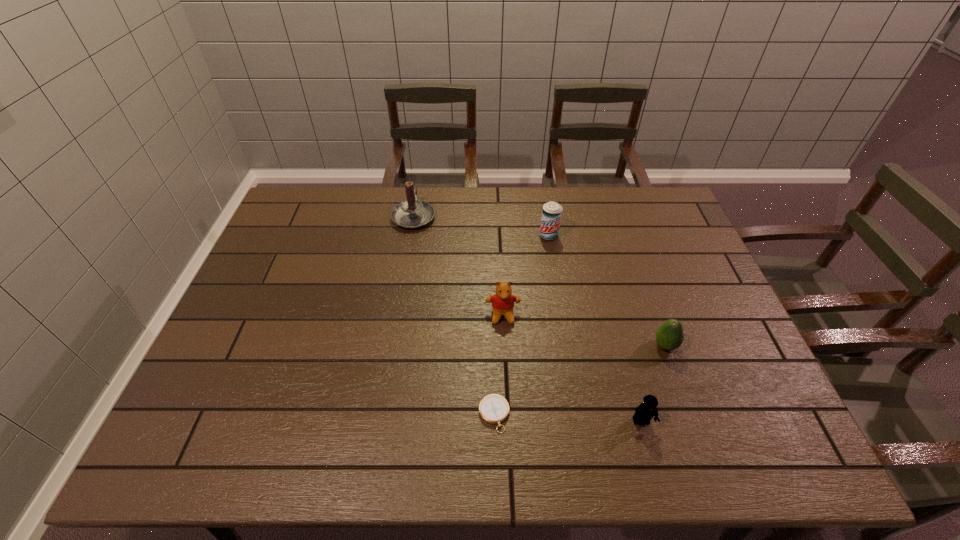
Identify the location of free spot located on the back of the avocado. This screenshot has height=540, width=960. (638, 271).

The width and height of the screenshot is (960, 540). Find the location of `free location located 0.070m on the front-facing side of the Lego`. free location located 0.070m on the front-facing side of the Lego is located at coordinates (652, 462).

Image resolution: width=960 pixels, height=540 pixels. Find the location of `free space located on the left of the shortest object`. free space located on the left of the shortest object is located at coordinates (386, 415).

Locate an element on the screen. Image resolution: width=960 pixels, height=540 pixels. candle present at the far edge is located at coordinates (412, 214).

The image size is (960, 540). Find the location of `beer can present at the far edge`. beer can present at the far edge is located at coordinates (552, 211).

Where is `Lego at the near edge`? This screenshot has width=960, height=540. Lego at the near edge is located at coordinates (645, 411).

Identify the location of compass situated at the near edge. (494, 409).

In the image, there is a desktop. Where is `vacant area at the far edge`? Image resolution: width=960 pixels, height=540 pixels. vacant area at the far edge is located at coordinates (469, 205).

Image resolution: width=960 pixels, height=540 pixels. In order to click on vacant area at the left edge of the desktop in this screenshot , I will do `click(279, 262)`.

Locate an element on the screen. The image size is (960, 540). vacant space at the right edge of the desktop is located at coordinates (755, 375).